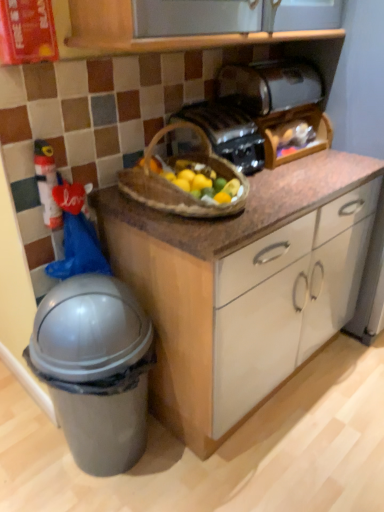
Find the location of a particular element. This screenshot has height=512, width=384. vacant space underneath gray plastic trash can at lower left (from a real-world perspective) is located at coordinates (119, 473).